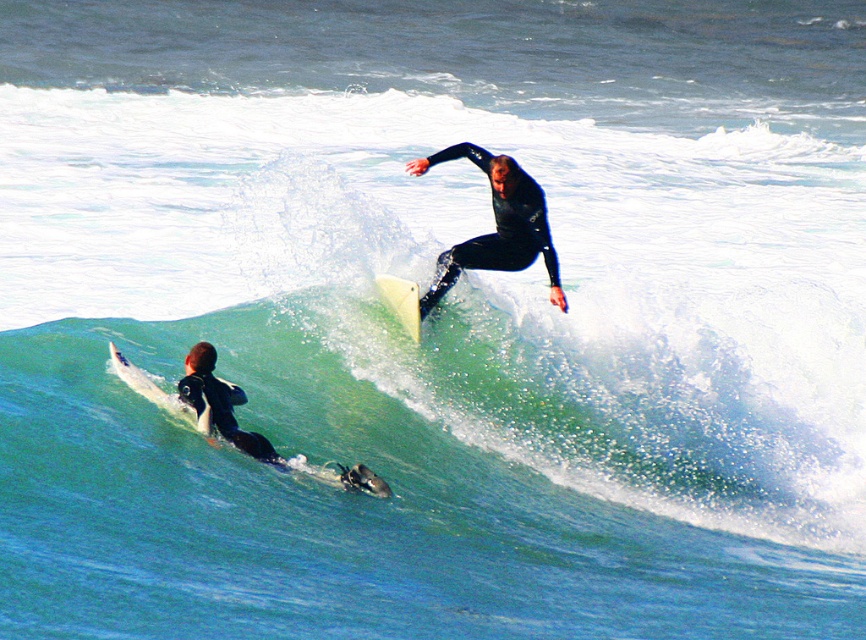
Question: Based on their relative distances, which object is farther from the black wetsuit surfer at lower left?

Choices:
 (A) black matte wetsuit at upper center
 (B) green rubber wave at center

Answer: (B)

Question: Which point is farther to the camera?

Choices:
 (A) white smooth surfboard at center
 (B) black matte wetsuit at upper center

Answer: (B)

Question: Does black wetsuit surfer at lower left lie in front of white smooth surfboard at center?

Choices:
 (A) no
 (B) yes

Answer: (B)

Question: Considering the relative positions of green rubber wave at center and white smooth surfboard at center in the image provided, where is green rubber wave at center located with respect to white smooth surfboard at center?

Choices:
 (A) above
 (B) below

Answer: (A)

Question: Estimate the real-world distances between objects in this image. Which object is farther from the green rubber wave at center?

Choices:
 (A) white smooth surfboard at center
 (B) black wetsuit surfer at lower left

Answer: (B)

Question: Is black matte wetsuit at upper center bigger than white smooth surfboard at center?

Choices:
 (A) no
 (B) yes

Answer: (B)